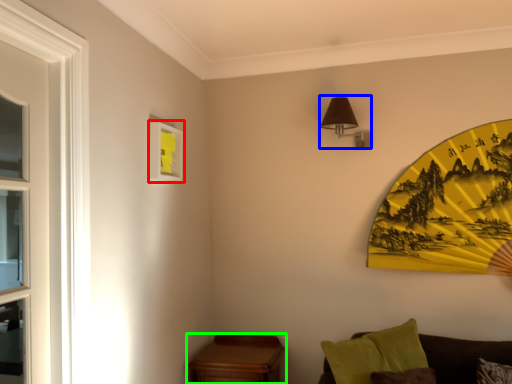
Question: Considering the real-world distances, which object is closest to picture frame (highlighted by a red box)? light fixture (highlighted by a blue box) or table (highlighted by a green box).

Choices:
 (A) light fixture
 (B) table

Answer: (A)